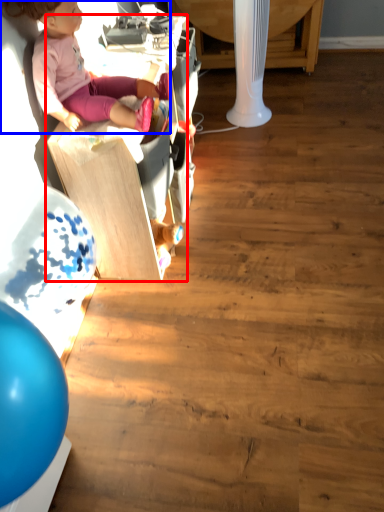
Question: Among these objects, which one is nearest to the camera, furniture (highlighted by a red box) or person (highlighted by a blue box)?

Choices:
 (A) furniture
 (B) person

Answer: (B)